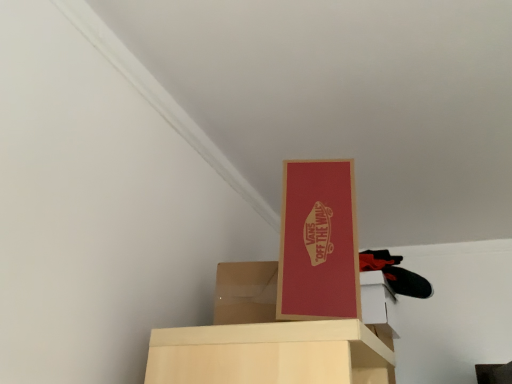
Measure the distance between point (315, 287) and camera.

The depth of point (315, 287) is 30.31 inches.

What do you see at coordinates (318, 242) in the screenshot? The height and width of the screenshot is (384, 512). I see `matte cardboard box at upper center` at bounding box center [318, 242].

Image resolution: width=512 pixels, height=384 pixels. I want to click on matte cardboard box at upper center, so click(318, 242).

Image resolution: width=512 pixels, height=384 pixels. I want to click on matte cardboard box at upper center, so click(x=318, y=242).